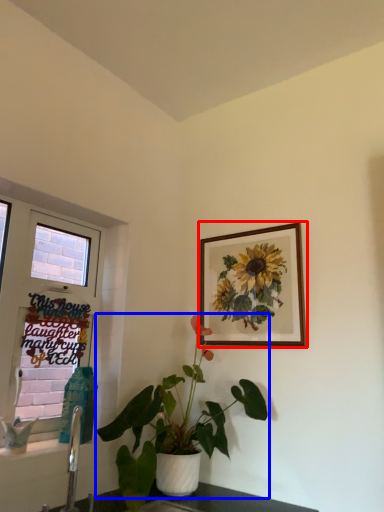
Question: Which of the following is the farthest to the observer, picture frame (highlighted by a red box) or houseplant (highlighted by a blue box)?

Choices:
 (A) picture frame
 (B) houseplant

Answer: (A)